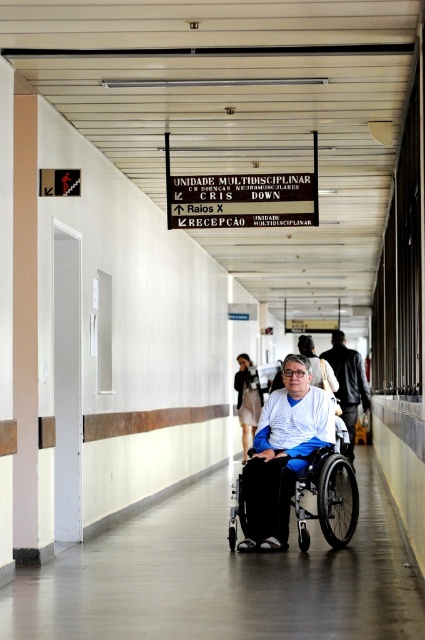
You are a maintenance worker in a hospital corridor. You need to replace the black plastic sign at upper center and the silver metallic wheelchair at center. Which object requires a ladder to reach?

The black plastic sign at upper center requires a ladder to reach because it is larger in size than the silver metallic wheelchair at center, implying it is positioned higher up.

You are a maintenance worker in the hospital and you need to reach the black plastic sign at upper center for inspection. Your wheelchair has a maximum range of 8 meters. Can you reach it without moving your wheelchair?

The black plastic sign at upper center is 8.76 meters away from camera, which is beyond the wheelchair range of 8 meters. Therefore, you cannot reach it without moving your wheelchair.